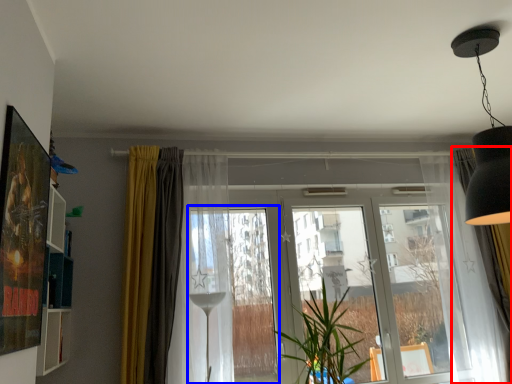
Question: Which of the following is the closest to the observer, curtain (highlighted by a red box) or window frame (highlighted by a blue box)?

Choices:
 (A) curtain
 (B) window frame

Answer: (B)